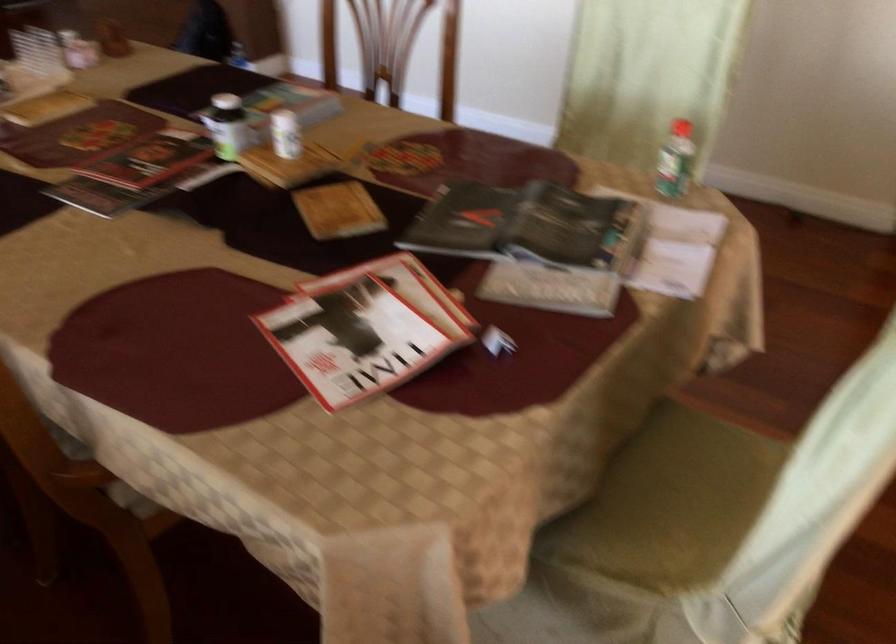
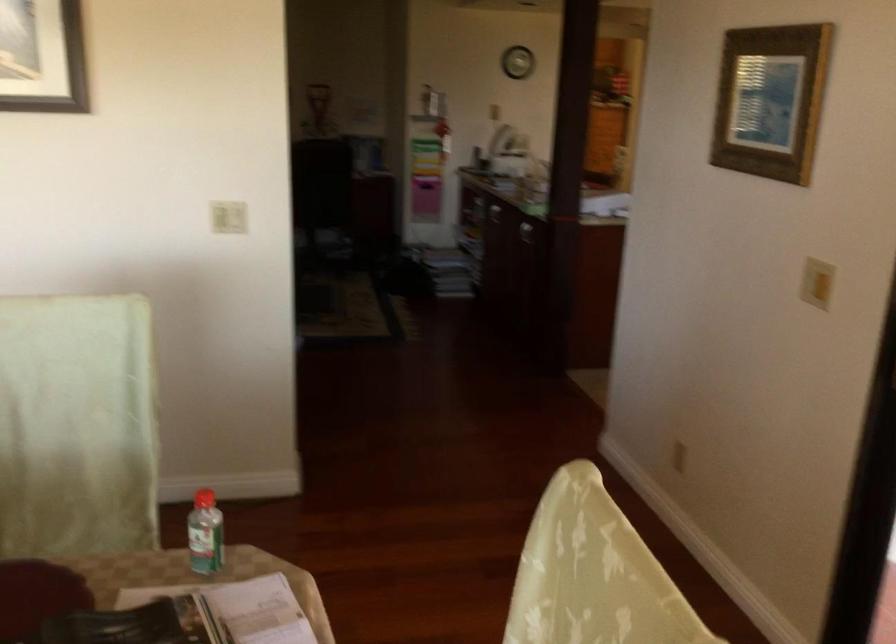
The point at (673, 220) is marked in the first image. Where is the corresponding point in the second image?

(238, 609)